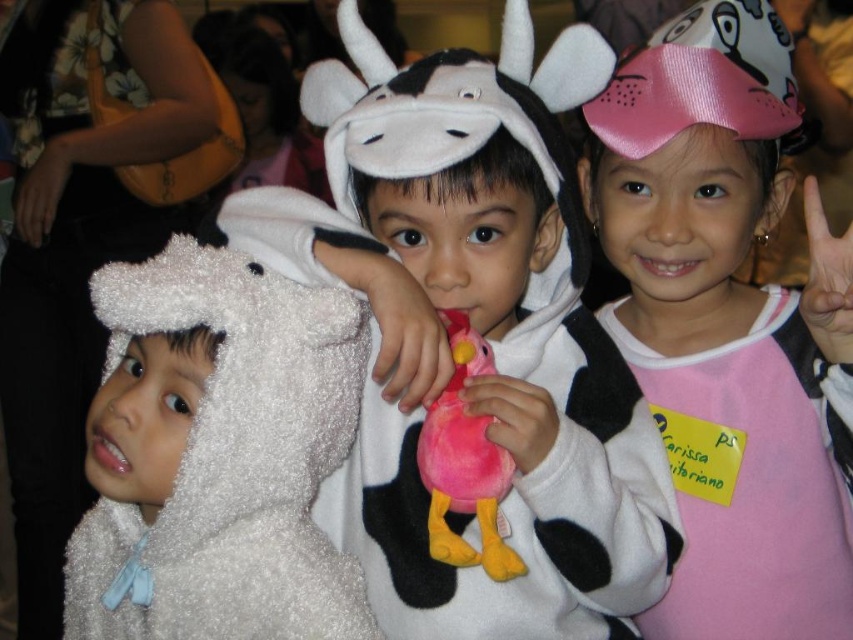
Question: Can you confirm if white fluffy costume at left is positioned above pink plush toy at center?

Choices:
 (A) no
 (B) yes

Answer: (A)

Question: Is pink satin bow at upper center positioned behind white fluffy costume at left?

Choices:
 (A) no
 (B) yes

Answer: (B)

Question: Estimate the real-world distances between objects in this image. Which object is closer to the white fluffy costume at left?

Choices:
 (A) pink plush toy at center
 (B) pink satin bow at upper center

Answer: (A)

Question: Does fluffy white costume at center have a larger size compared to pink plush toy at center?

Choices:
 (A) yes
 (B) no

Answer: (A)

Question: Among these points, which one is nearest to the camera?

Choices:
 (A) (780, 364)
 (B) (273, 324)

Answer: (B)

Question: Among these points, which one is farthest from the camera?

Choices:
 (A) (468, 484)
 (B) (215, 272)
 (C) (575, 416)
 (D) (619, 204)

Answer: (D)